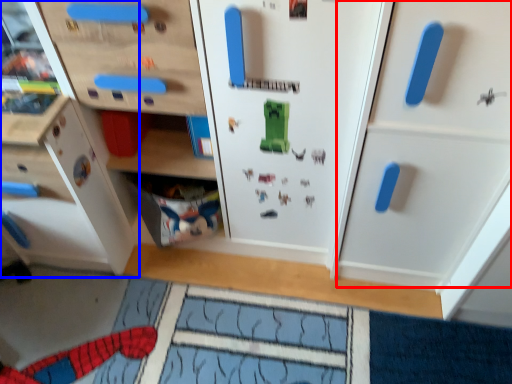
Question: Which of the following is the farthest to the observer, cabinetry (highlighted by a red box) or cabinetry (highlighted by a blue box)?

Choices:
 (A) cabinetry
 (B) cabinetry

Answer: (B)